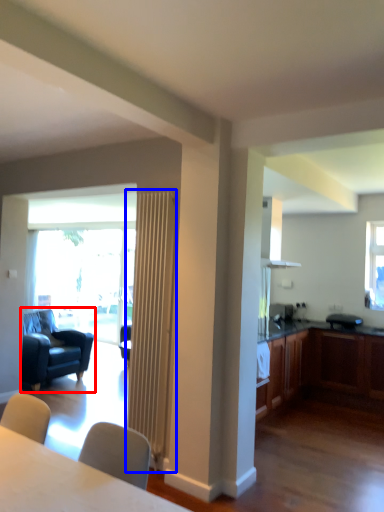
Question: Which point is further to the camera, chair (highlighted by a red box) or radiator (highlighted by a blue box)?

Choices:
 (A) chair
 (B) radiator

Answer: (A)